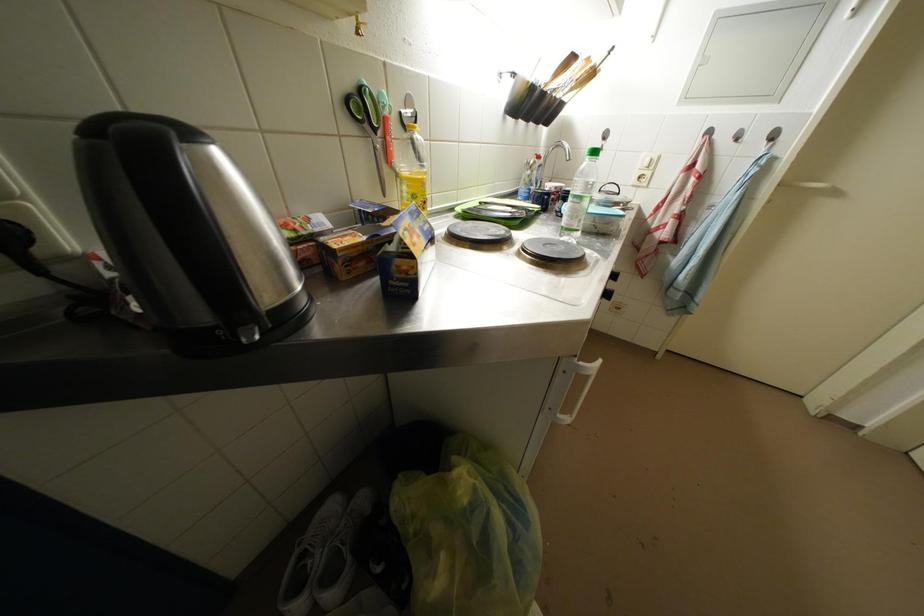
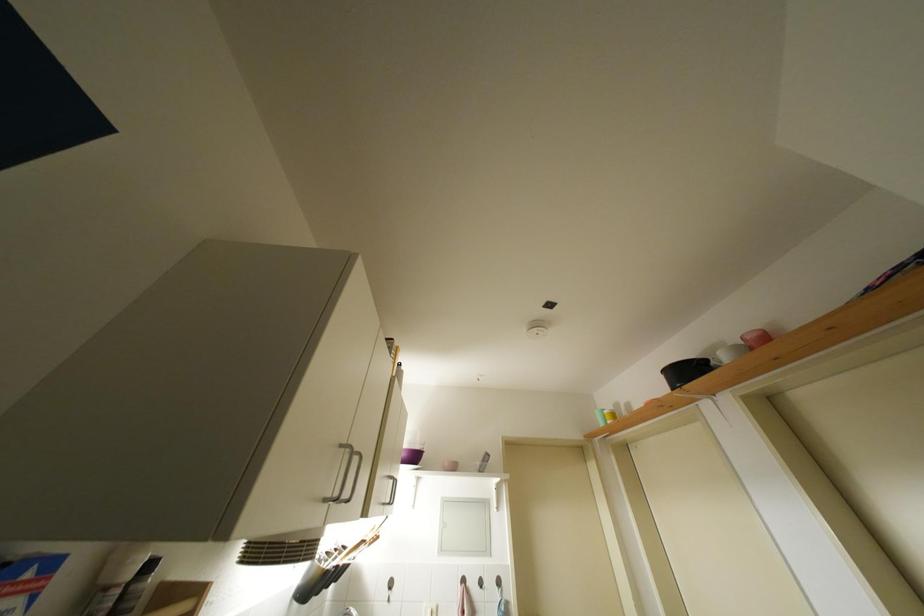
The point at (693, 102) is marked in the first image. Where is the corresponding point in the second image?

(447, 554)